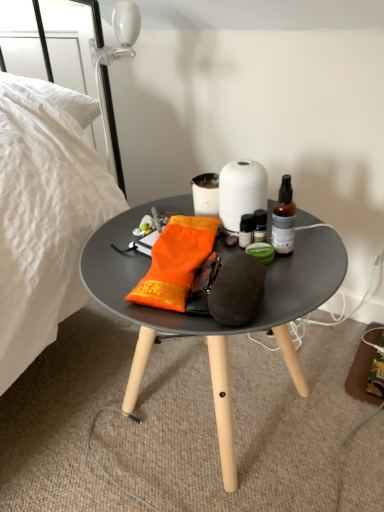
This screenshot has height=512, width=384. Find the location of `free space that is to the left of matte gray coffee table at center`. free space that is to the left of matte gray coffee table at center is located at coordinates (67, 402).